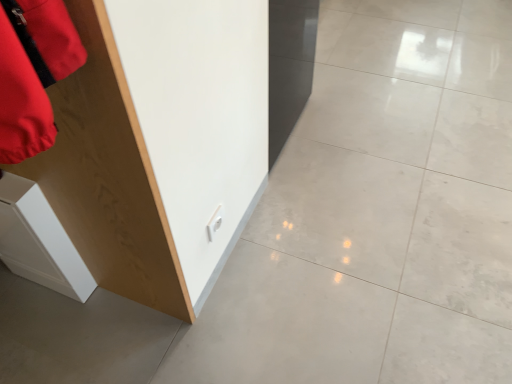
Question: Does white polished concrete at center appear on the right side of white glossy cabinet at lower left?

Choices:
 (A) no
 (B) yes

Answer: (B)

Question: Does white polished concrete at center have a lesser width compared to white glossy cabinet at lower left?

Choices:
 (A) no
 (B) yes

Answer: (A)

Question: Would you consider white polished concrete at center to be distant from white glossy cabinet at lower left?

Choices:
 (A) yes
 (B) no

Answer: (B)

Question: From the image's perspective, is white polished concrete at center over white glossy cabinet at lower left?

Choices:
 (A) no
 (B) yes

Answer: (B)

Question: Is the position of white polished concrete at center more distant than that of white glossy cabinet at lower left?

Choices:
 (A) no
 (B) yes

Answer: (A)

Question: Is white glossy cabinet at lower left inside the boundaries of white polished concrete at center, or outside?

Choices:
 (A) outside
 (B) inside

Answer: (A)

Question: Is white glossy cabinet at lower left to the left or to the right of white polished concrete at center in the image?

Choices:
 (A) right
 (B) left

Answer: (B)

Question: Is white glossy cabinet at lower left bigger or smaller than white polished concrete at center?

Choices:
 (A) small
 (B) big

Answer: (A)

Question: Is white glossy cabinet at lower left wider or thinner than white polished concrete at center?

Choices:
 (A) thin
 (B) wide

Answer: (A)

Question: Looking at their shapes, would you say wooden cabinet at left is wider or thinner than white polished concrete at center?

Choices:
 (A) wide
 (B) thin

Answer: (B)

Question: From a real-world perspective, relative to white polished concrete at center, is wooden cabinet at left vertically above or below?

Choices:
 (A) below
 (B) above

Answer: (B)

Question: From the image's perspective, is wooden cabinet at left located above or below white polished concrete at center?

Choices:
 (A) above
 (B) below

Answer: (B)

Question: Considering the relative positions of wooden cabinet at left and white polished concrete at center in the image provided, is wooden cabinet at left to the left or to the right of white polished concrete at center?

Choices:
 (A) left
 (B) right

Answer: (A)

Question: From a real-world perspective, is white polished concrete at center physically located above or below wooden cabinet at left?

Choices:
 (A) below
 (B) above

Answer: (A)

Question: From the image's perspective, is white polished concrete at center above or below wooden cabinet at left?

Choices:
 (A) below
 (B) above

Answer: (B)